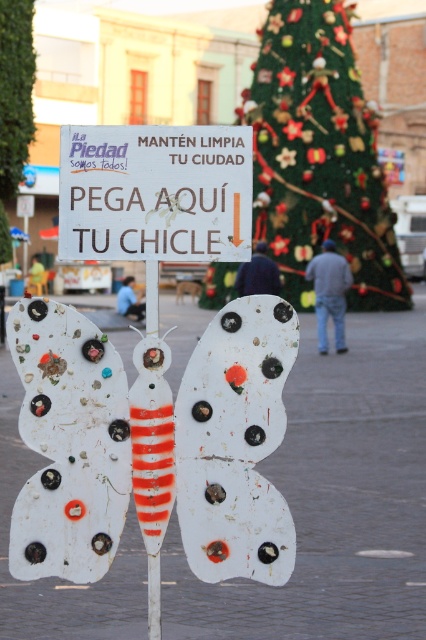
Question: Can you confirm if white plastic butterfly at center is wider than white matte sign at center?

Choices:
 (A) yes
 (B) no

Answer: (B)

Question: Among these points, which one is farthest from the camera?

Choices:
 (A) (74, 525)
 (B) (164, 157)
 (C) (294, 77)

Answer: (C)

Question: Is white matte butterfly at center closer to the viewer compared to white matte sign at center?

Choices:
 (A) no
 (B) yes

Answer: (B)

Question: Which object appears closest to the camera in this image?

Choices:
 (A) white matte sign at center
 (B) white plastic butterfly at center
 (C) white matte butterfly at center
 (D) green textured christmas tree at center

Answer: (D)

Question: Which object is farther from the camera taking this photo?

Choices:
 (A) white plastic butterfly at center
 (B) green textured christmas tree at center

Answer: (A)

Question: In this image, where is white matte butterfly at center located relative to white matte sign at center?

Choices:
 (A) below
 (B) above

Answer: (A)